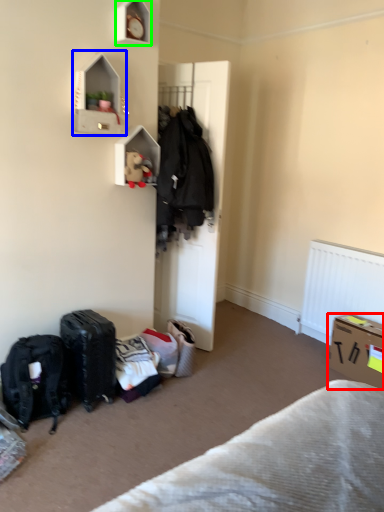
Question: Which object is positioned farthest from box (highlighted by a red box)? Select from cabinet (highlighted by a blue box) and shelf (highlighted by a green box).

Choices:
 (A) cabinet
 (B) shelf

Answer: (B)